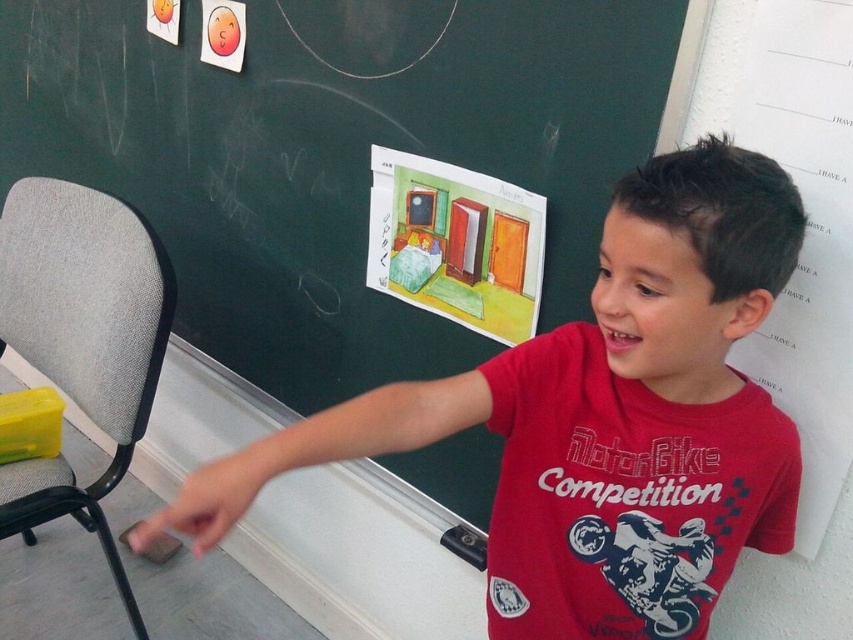
Question: Is matte paper drawing at upper center above red cotton shirt at center?

Choices:
 (A) yes
 (B) no

Answer: (A)

Question: Does matte paper drawing at upper center have a lesser width compared to red cotton shirt at center?

Choices:
 (A) yes
 (B) no

Answer: (B)

Question: Is the position of matte paper drawing at upper center more distant than that of gray fabric chair at left?

Choices:
 (A) no
 (B) yes

Answer: (A)

Question: Which point is farther to the camera?

Choices:
 (A) gray fabric chair at left
 (B) red cotton shirt at center
 (C) matte paper drawing at upper center

Answer: (A)

Question: Which object appears farthest from the camera in this image?

Choices:
 (A) matte paper drawing at upper center
 (B) red cotton shirt at center
 (C) gray fabric chair at left

Answer: (C)

Question: Among these points, which one is farthest from the camera?

Choices:
 (A) (556, 310)
 (B) (109, 314)

Answer: (B)